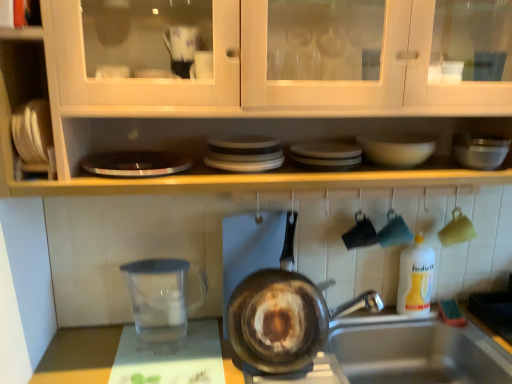
Question: From the image's perspective, is rusty metal frying pan at center positioned above or below transparent plastic measuring cup at lower left?

Choices:
 (A) below
 (B) above

Answer: (B)

Question: Considering their positions, is rusty metal frying pan at center located in front of or behind transparent plastic measuring cup at lower left?

Choices:
 (A) behind
 (B) front

Answer: (B)

Question: Which of these objects is positioned farthest from the rusty metal frying pan at center?

Choices:
 (A) silver metallic sink at lower right
 (B) transparent glass water at lower left
 (C) white glossy bowl at upper center
 (D) metallic silver mixing bowl at upper right
 (E) white plastic bottle at right

Answer: (D)

Question: Based on their relative distances, which object is farther from the silver metallic sink at lower right?

Choices:
 (A) white plastic bottle at right
 (B) metallic silver mixing bowl at upper right
 (C) transparent glass water at lower left
 (D) white glossy bowl at upper center
 (E) rusty metal frying pan at center

Answer: (C)